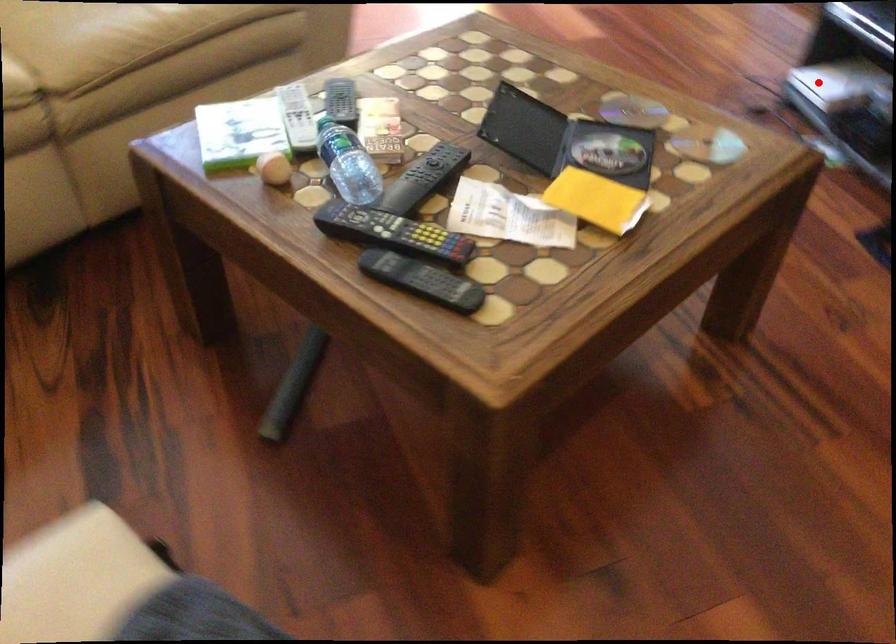
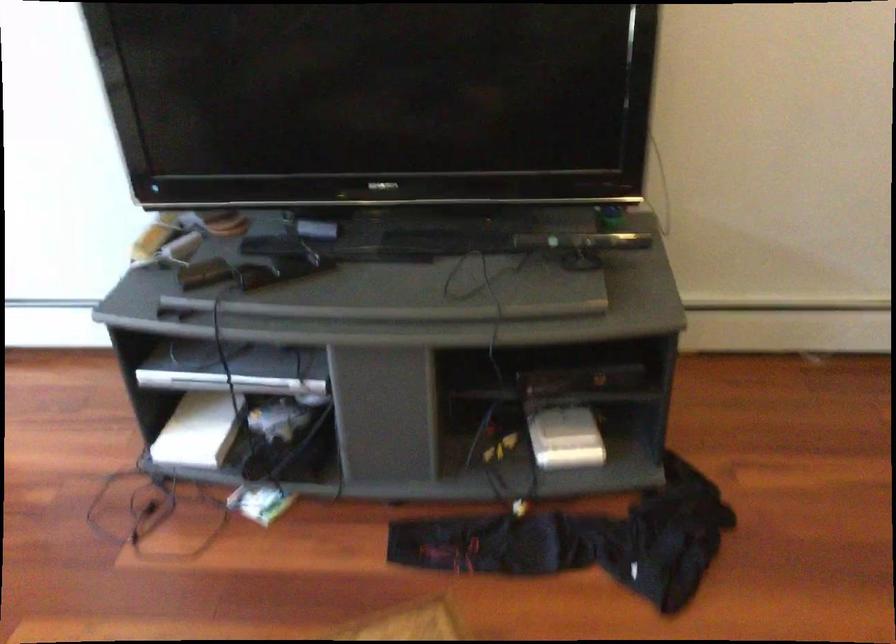
In the second image, find the point that corresponds to the highlighted location in the first image.

(199, 430)